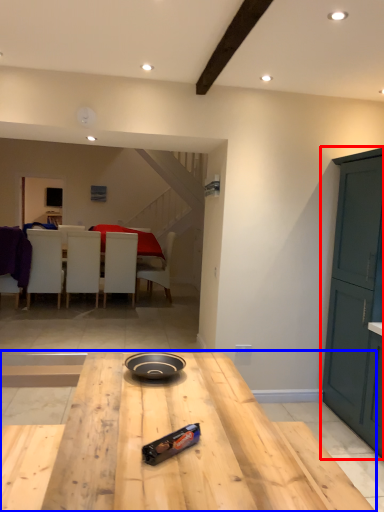
Question: Among these objects, which one is farthest to the camera, cabinetry (highlighted by a red box) or table (highlighted by a blue box)?

Choices:
 (A) cabinetry
 (B) table

Answer: (A)